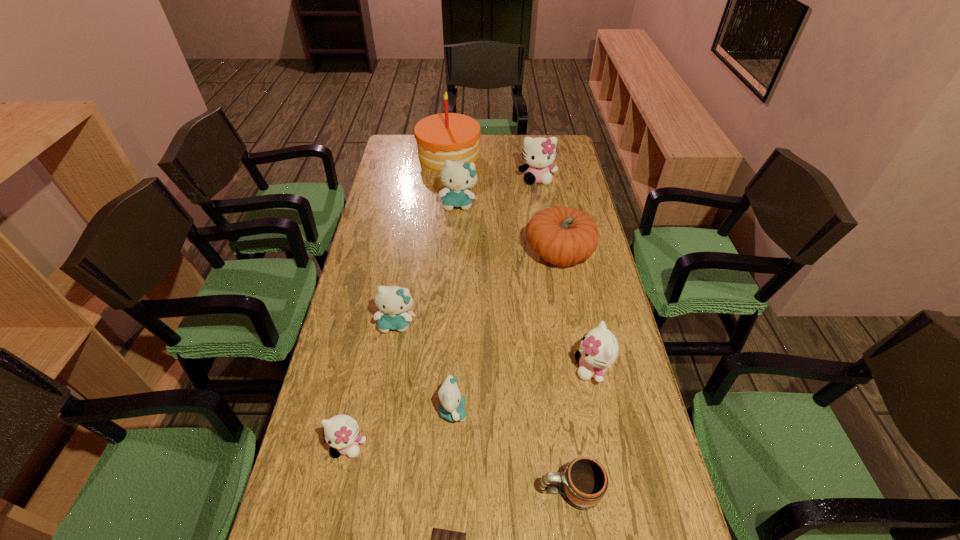
Identify the location of the second farthest blue kitten. This screenshot has height=540, width=960. (394, 302).

At what (x,y) coordinates should I click in order to perform the action: click on the fifth farthest object. Please return your answer as a coordinate pair (x, y). This screenshot has height=540, width=960. Looking at the image, I should click on (394, 302).

Identify the location of the fourth nearest object. (451, 408).

At what (x,y) coordinates should I click in order to perform the action: click on the nearest blue kitten. Please return your answer as a coordinate pair (x, y). The width and height of the screenshot is (960, 540). Looking at the image, I should click on (451, 408).

This screenshot has height=540, width=960. I want to click on the leftmost white kitten, so click(x=341, y=432).

In order to click on the smallest white kitten in this screenshot , I will do `click(341, 432)`.

Identify the location of the ninth farthest object. (584, 481).

Identify the location of the second shortest object. (584, 481).

What are the coordinates of `vacant space situated 0.210m on the right of the birthday cake` in the screenshot? It's located at (526, 154).

Where is `free location located on the face of the eighth nearest object`? The height and width of the screenshot is (540, 960). free location located on the face of the eighth nearest object is located at coordinates (455, 262).